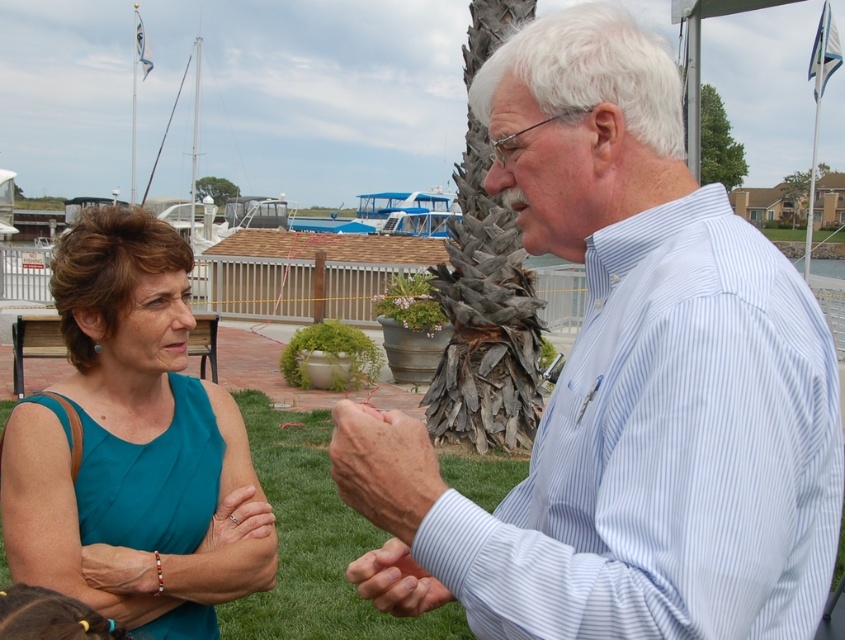
Question: Which point is farther to the camera?

Choices:
 (A) dry skin at center
 (B) blue striped shirt at center

Answer: (A)

Question: Can you confirm if gray textured palm tree at center is bigger than smooth skin hand at center?

Choices:
 (A) yes
 (B) no

Answer: (A)

Question: Considering the relative positions of blue striped shirt at center and teal fabric dress at left in the image provided, where is blue striped shirt at center located with respect to teal fabric dress at left?

Choices:
 (A) right
 (B) left

Answer: (A)

Question: Which of the following is the closest to the observer?

Choices:
 (A) (151, 508)
 (B) (491, 328)
 (C) (383, 573)
 (D) (649, 179)

Answer: (D)

Question: Which object is positioned closest to the blue striped shirt at center?

Choices:
 (A) dry skin at center
 (B) smooth skin hand at center
 (C) teal fabric dress at left

Answer: (A)

Question: Can you confirm if gray textured palm tree at center is smaller than dry skin at center?

Choices:
 (A) no
 (B) yes

Answer: (A)